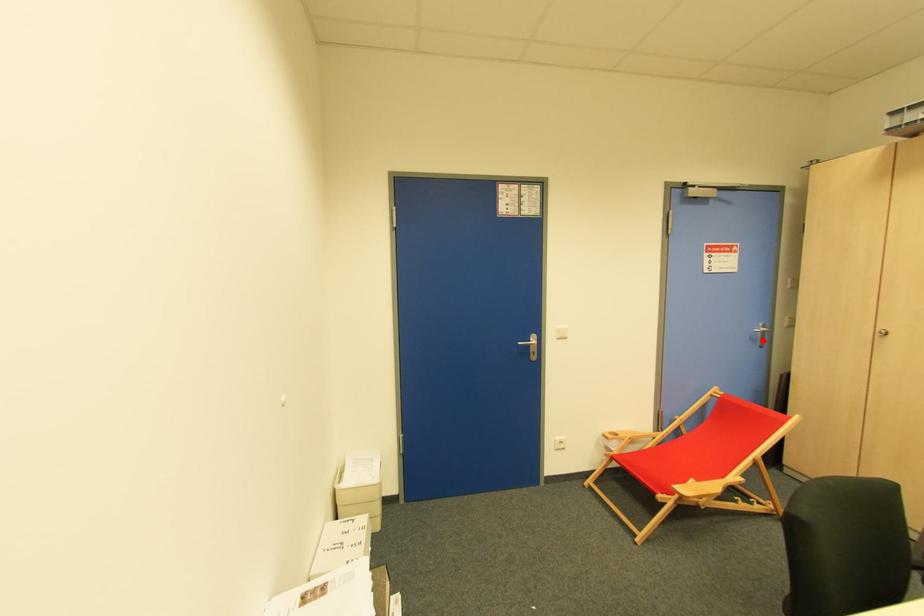
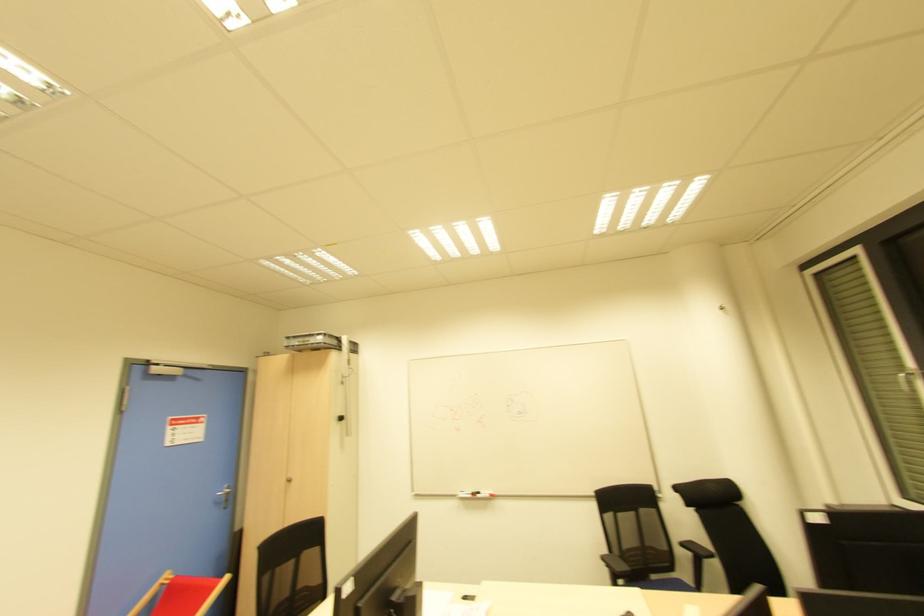
Find the pixel in the second image that matches the highlighted location in the first image.

(225, 501)